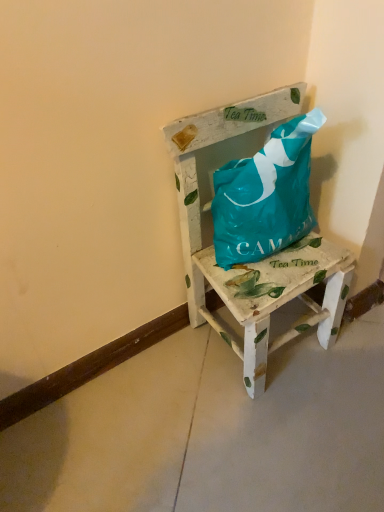
At what (x,y) coordinates should I click in order to perform the action: click on white painted wood chair at center. Please return your answer as a coordinate pair (x, y). Looking at the image, I should click on (251, 264).

Describe the element at coordinates (251, 264) in the screenshot. I see `white painted wood chair at center` at that location.

Where is `white painted wood chair at center`? The image size is (384, 512). white painted wood chair at center is located at coordinates (251, 264).